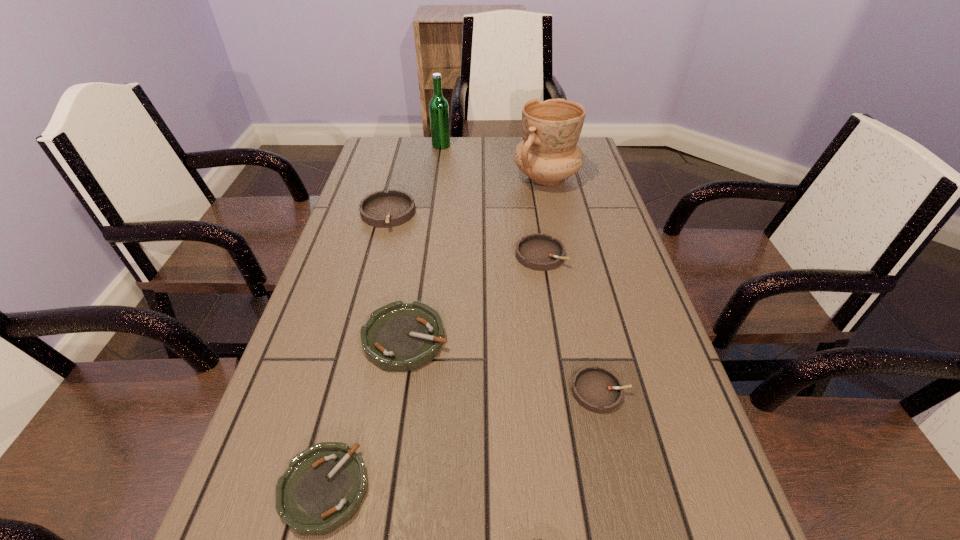
You are a GUI agent. You are given a task and a screenshot of the screen. Output one action in this format:
    pyautogui.click(x=<x>, y=<y>)
    Task: Click on the empty location between the third farthest object and the beer bottle
    
    Given the screenshot: What is the action you would take?
    pyautogui.click(x=415, y=180)

I want to click on vacant area that lies between the bigger green ashtray and the second farthest object, so click(x=476, y=258).

Identify the location of free space between the fourth nearest ashtray and the green beer bottle. (x=491, y=200).

Select which object is the fifth closest to the smallest gray ashtray. Please provide its 2D coordinates. Your answer should be formatted as a tuple, i.e. [(x, y)], where the tuple contains the x and y coordinates of a point satisfying the conditions above.

[(548, 154)]

Locate which object ranks third in proximity to the beer bottle. Please provide its 2D coordinates. Your answer should be formatted as a tuple, i.e. [(x, y)], where the tuple contains the x and y coordinates of a point satisfying the conditions above.

[(540, 252)]

The image size is (960, 540). I want to click on ashtray that is the closest to the pottery, so click(x=540, y=252).

Locate an element on the screen. The width and height of the screenshot is (960, 540). ashtray that can be found as the second closest to the beige pottery is located at coordinates (381, 209).

The height and width of the screenshot is (540, 960). Identify the location of gray ashtray object that ranks as the closest to the bigger green ashtray. (540, 252).

Choose which gray ashtray is the second nearest neighbor to the green beer bottle. Please provide its 2D coordinates. Your answer should be formatted as a tuple, i.e. [(x, y)], where the tuple contains the x and y coordinates of a point satisfying the conditions above.

[(540, 252)]

Where is `green ashtray that is the closest to the farthest object`? The height and width of the screenshot is (540, 960). green ashtray that is the closest to the farthest object is located at coordinates (399, 336).